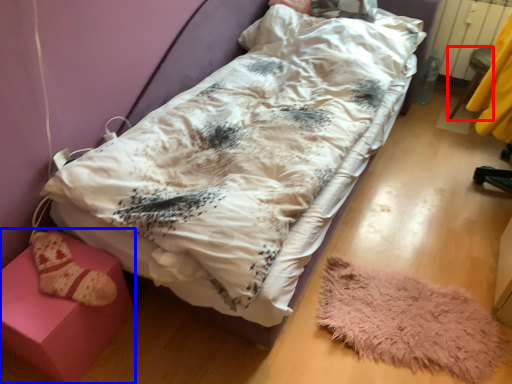
Question: Among these objects, which one is nearest to the camera, furniture (highlighted by a red box) or furniture (highlighted by a blue box)?

Choices:
 (A) furniture
 (B) furniture

Answer: (B)